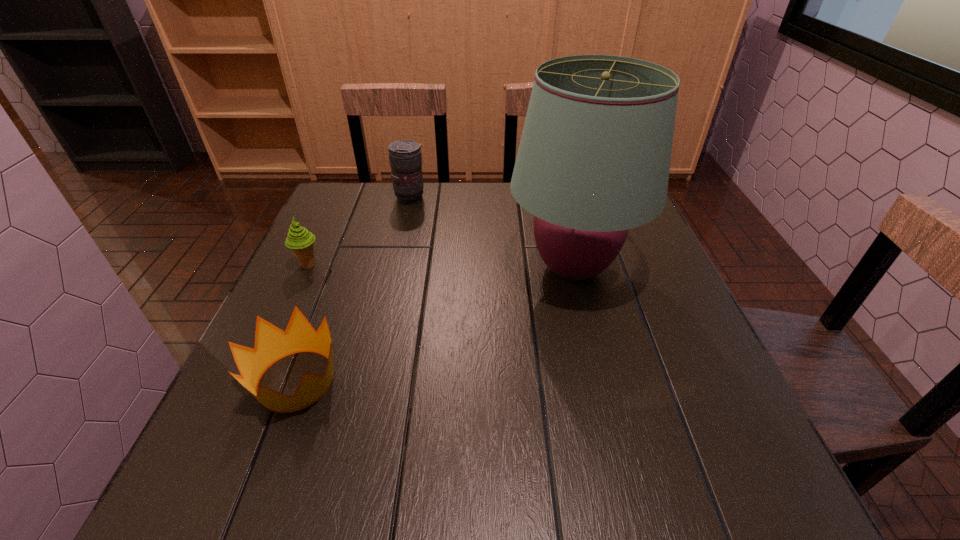
The image size is (960, 540). Find the location of `free space that is in between the second tallest object and the icecream`. free space that is in between the second tallest object and the icecream is located at coordinates (359, 232).

Locate an element on the screen. The height and width of the screenshot is (540, 960). free space between the second tallest object and the rightmost object is located at coordinates (492, 233).

Locate an element on the screen. The height and width of the screenshot is (540, 960). free point between the third object from left to right and the shortest object is located at coordinates (353, 289).

This screenshot has height=540, width=960. Identify the location of vacant region between the telephoto lens and the icecream. (359, 232).

Find the location of `free point between the second object from right to left and the rightmost object`. free point between the second object from right to left and the rightmost object is located at coordinates (492, 233).

Locate an element on the screen. Image resolution: width=960 pixels, height=540 pixels. unoccupied area between the second object from right to left and the icecream is located at coordinates (359, 232).

This screenshot has height=540, width=960. Find the location of `free space between the third object from left to right and the lampshade`. free space between the third object from left to right and the lampshade is located at coordinates (492, 233).

Locate an element on the screen. The image size is (960, 540). object identified as the third closest to the rightmost object is located at coordinates click(301, 242).

Identify which object is located as the nearest to the shortest object. Please provide its 2D coordinates. Your answer should be formatted as a tuple, i.e. [(x, y)], where the tuple contains the x and y coordinates of a point satisfying the conditions above.

[(301, 242)]

Find the location of `free spot that satisfies the following two spatial constraints: 1. on the side of the lampshade where the control switches are located; 2. on the right side of the telephoto lens`. free spot that satisfies the following two spatial constraints: 1. on the side of the lampshade where the control switches are located; 2. on the right side of the telephoto lens is located at coordinates (395, 268).